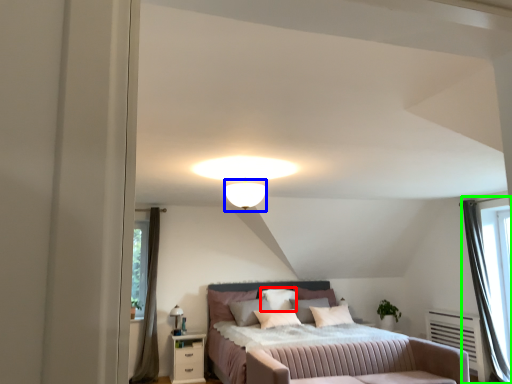
Question: Which object is positioned farthest from pillow (highlighted by a red box)? Select from lighting (highlighted by a blue box) and curtain (highlighted by a green box).

Choices:
 (A) lighting
 (B) curtain

Answer: (B)